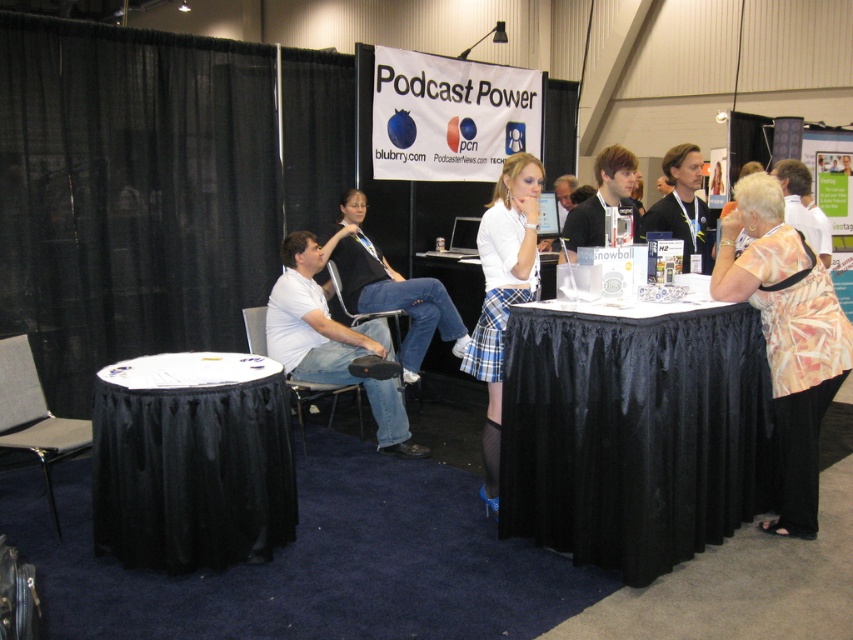
Question: Is printed silk blouse at lower right closer to the viewer compared to gray fabric chair at lower left?

Choices:
 (A) no
 (B) yes

Answer: (A)

Question: Is white satin table at lower left below black fabric chair at center?

Choices:
 (A) no
 (B) yes

Answer: (B)

Question: Is black satin table at center further to camera compared to black fabric chair at center?

Choices:
 (A) yes
 (B) no

Answer: (B)

Question: Which point is farther to the camera?

Choices:
 (A) black fabric chair at center
 (B) black fabric chair at lower left
 (C) white satin table at lower left
 (D) gray fabric chair at lower left

Answer: (A)

Question: Estimate the real-world distances between objects in this image. Which object is closer to the black fabric chair at center?

Choices:
 (A) printed silk blouse at lower right
 (B) gray fabric chair at lower left
 (C) white matte skirt at center

Answer: (C)

Question: Which point is farther to the camera?

Choices:
 (A) (15, 348)
 (B) (773, 323)
 (C) (331, 266)

Answer: (C)